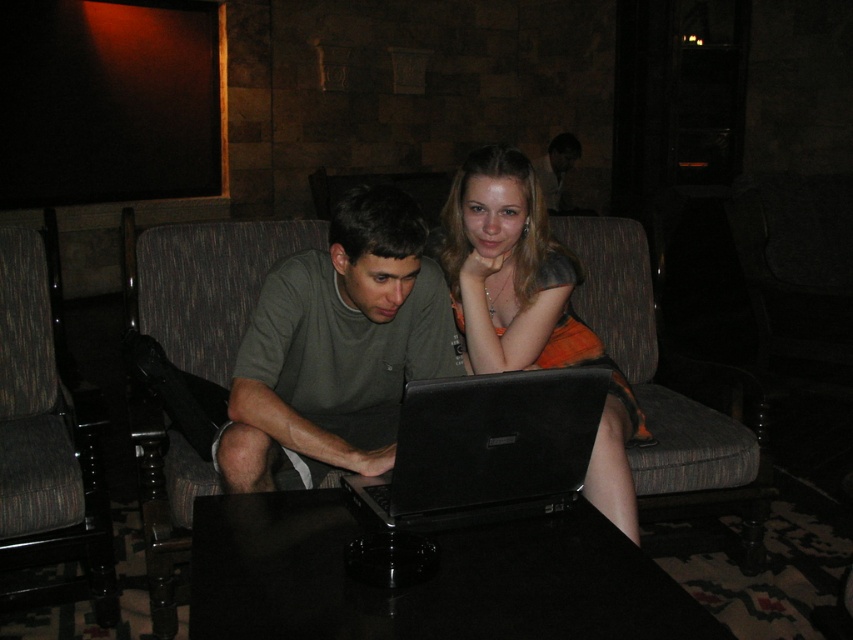
You are a photographer setting up for a group photo in the lounge. You need to ensure that the matte black laptop at center and the dark brown leather jacket at upper center are both visible in the frame. Based on their positions, will the jacket block the view of the laptop?

The matte black laptop at center is positioned under the dark brown leather jacket at upper center, so the jacket will block the view of the laptop.

You are a photographer setting up for a portrait session in this room. You need to ensure that the matte black laptop at center does not block the dark brown leather jacket at upper center in the photo. Based on their positions, will the laptop obscure the jacket in the shot?

The matte black laptop at center is in front of the dark brown leather jacket at upper center, so it will block the jacket in the photo.

Based on the photo, you are a photographer setting up a shoot in the scene. You need to place a light source to the right of the dark brown leather jacket at upper center. Will this light also illuminate the green matte shirt at center?

The green matte shirt at center is to the left of dark brown leather jacket at upper center. Since the light is placed to the right of the jacket, it would not directly illuminate the shirt, which is on the opposite side.